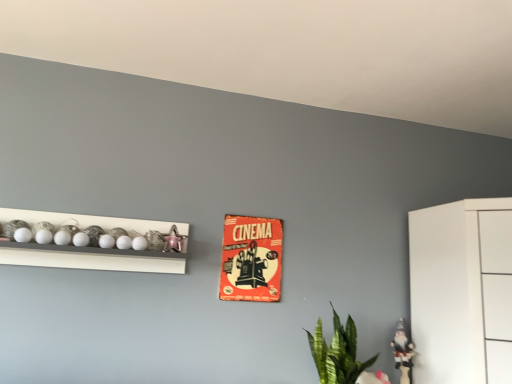
Question: Is white glossy gnome at lower right, arranged as the second toy when viewed from the front, positioned behind green leafy plant at lower right?

Choices:
 (A) yes
 (B) no

Answer: (A)

Question: Can you confirm if white glossy gnome at lower right, which ranks as the first toy in bottom-to-top order, is positioned to the left of green leafy plant at lower right?

Choices:
 (A) yes
 (B) no

Answer: (B)

Question: Is white glossy gnome at lower right, positioned as the second toy in top-to-bottom order, shorter than green leafy plant at lower right?

Choices:
 (A) no
 (B) yes

Answer: (B)

Question: From a real-world perspective, is white glossy gnome at lower right, which ranks as the first toy in bottom-to-top order, below green leafy plant at lower right?

Choices:
 (A) yes
 (B) no

Answer: (A)

Question: Is white glossy gnome at lower right, arranged as the second toy when viewed from the front, at the right side of green leafy plant at lower right?

Choices:
 (A) yes
 (B) no

Answer: (A)

Question: From the image's perspective, is metallic pink star at upper left, placed as the 2th toy when sorted from right to left, on top of white glossy shelf at upper left?

Choices:
 (A) yes
 (B) no

Answer: (A)

Question: Is metallic pink star at upper left, marked as the 1th toy in a top-to-bottom arrangement, taller than white glossy shelf at upper left?

Choices:
 (A) no
 (B) yes

Answer: (A)

Question: From the image's perspective, is metallic pink star at upper left, marked as the 1th toy in a top-to-bottom arrangement, under white glossy shelf at upper left?

Choices:
 (A) yes
 (B) no

Answer: (B)

Question: Is metallic pink star at upper left, placed as the 2th toy when sorted from right to left, closer to the viewer compared to white glossy shelf at upper left?

Choices:
 (A) yes
 (B) no

Answer: (B)

Question: Is metallic pink star at upper left, the first toy from the left, positioned behind white glossy shelf at upper left?

Choices:
 (A) no
 (B) yes

Answer: (B)

Question: Is metallic pink star at upper left, marked as the 1th toy in a top-to-bottom arrangement, located outside white glossy shelf at upper left?

Choices:
 (A) yes
 (B) no

Answer: (B)

Question: Is red cardboard cinema poster at center looking in the opposite direction of white glossy shelf at upper left?

Choices:
 (A) yes
 (B) no

Answer: (B)